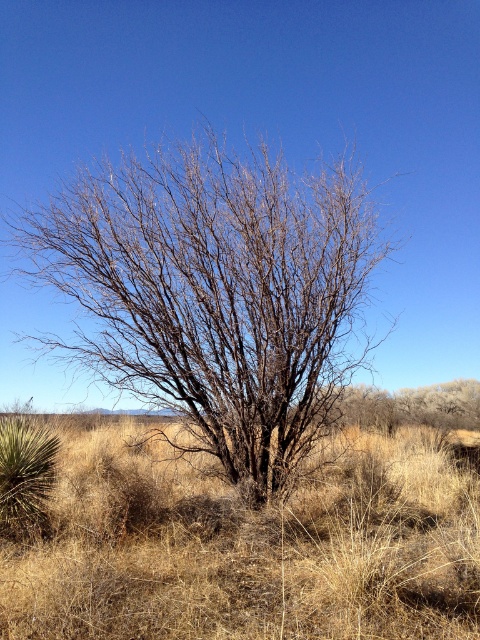
Is bare branches at center bigger than dry grass at center?

Incorrect, bare branches at center is not larger than dry grass at center.

Who is shorter, bare branches at center or dry grass at center?

dry grass at center

The width and height of the screenshot is (480, 640). Find the location of `bare branches at center`. bare branches at center is located at coordinates (215, 292).